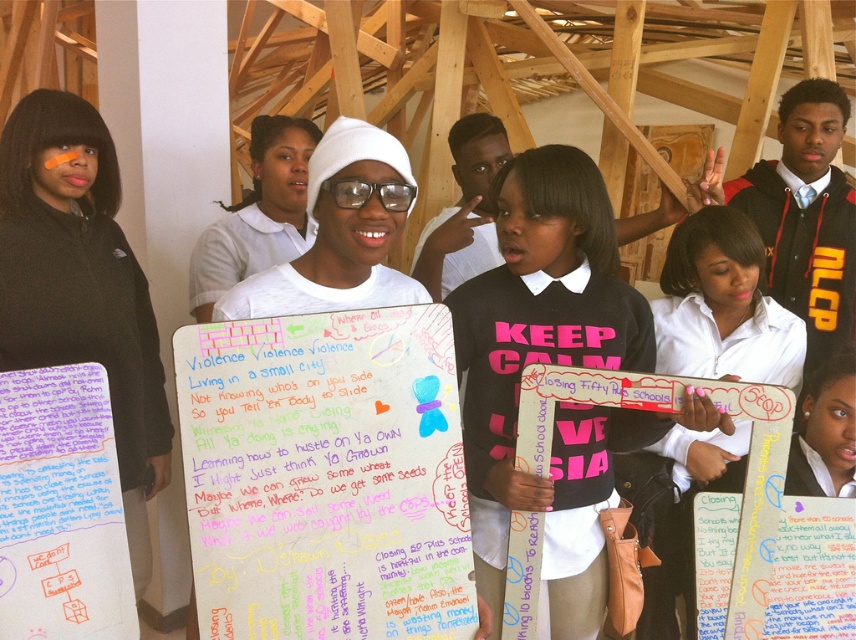
Is white matte shirt at center shorter than clear plastic goggles at center?

No.

Is white matte shirt at center below clear plastic goggles at center?

No, white matte shirt at center is not below clear plastic goggles at center.

Who is more distant from viewer, (x=244, y=243) or (x=384, y=205)?

Positioned behind is point (x=244, y=243).

Find the location of a particular element. white matte shirt at center is located at coordinates (259, 212).

Does handwritten paper at center have a lesser width compared to colored paper poster at center?

Correct, handwritten paper at center's width is less than colored paper poster at center's.

Between handwritten paper at center and colored paper poster at center, which one appears on the right side from the viewer's perspective?

colored paper poster at center is more to the right.

Is point (63, 532) positioned behind point (847, 634)?

That is False.

Locate an element on the screen. handwritten paper at center is located at coordinates (60, 508).

Can you confirm if white paper poster at center is bigger than white matte shirt at center?

Incorrect, white paper poster at center is not larger than white matte shirt at center.

Does white paper poster at center appear under white matte shirt at center?

Indeed, white paper poster at center is positioned under white matte shirt at center.

Which is in front, point (210, 620) or point (295, 145)?

Point (210, 620)

Where is `white paper poster at center`? white paper poster at center is located at coordinates (325, 476).